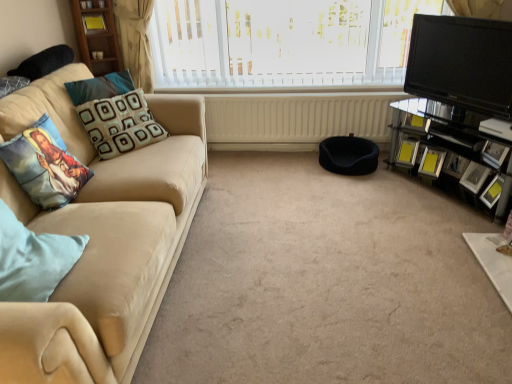
Where is `free space to the left of white glossy table at lower right`? The height and width of the screenshot is (384, 512). free space to the left of white glossy table at lower right is located at coordinates (436, 278).